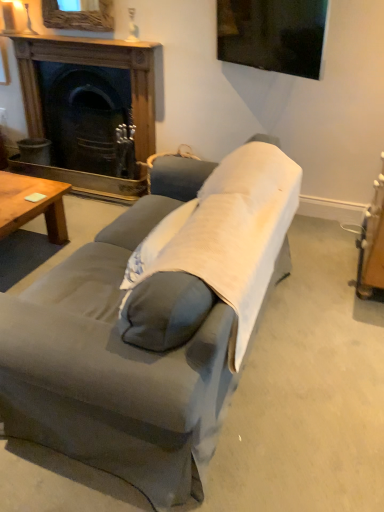
Question: In terms of height, does wooden coffee table at lower left look taller or shorter compared to light gray fabric pillow at center?

Choices:
 (A) tall
 (B) short

Answer: (B)

Question: Based on their sizes in the image, would you say wooden coffee table at lower left is bigger or smaller than light gray fabric pillow at center?

Choices:
 (A) small
 (B) big

Answer: (B)

Question: Which is nearer to the wooden fireplace at upper left?

Choices:
 (A) wooden coffee table at lower left
 (B) gray fabric couch at center
 (C) light gray fabric pillow at center

Answer: (A)

Question: Which is farther from the wooden coffee table at lower left?

Choices:
 (A) gray fabric couch at center
 (B) wooden fireplace at upper left
 (C) light gray fabric pillow at center

Answer: (A)